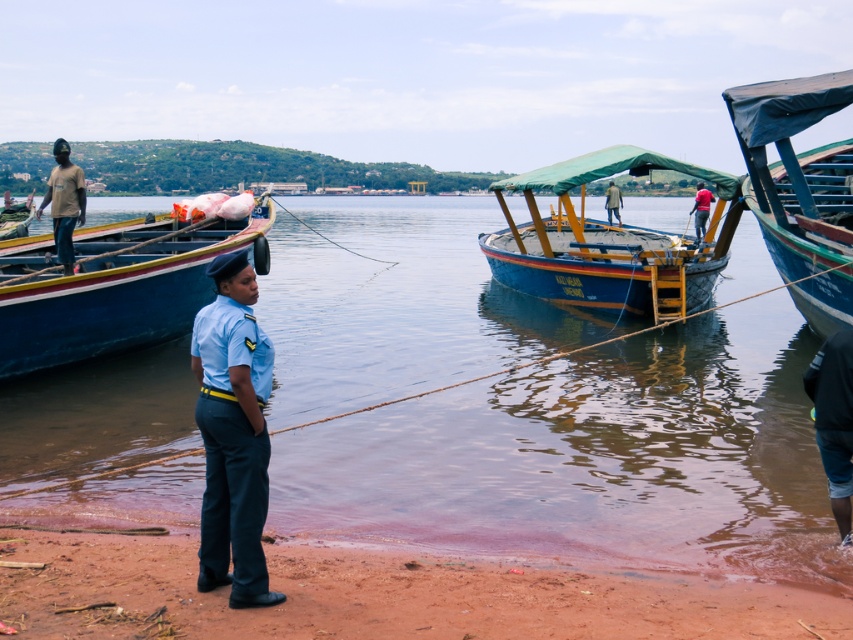
You are a photographer trying to capture both the matte brown shirt at left and the khaki fabric uniform at center in a single frame. Based on their positions, which one is more likely to be fully visible without any part being cut off?

The matte brown shirt at left is wider than the khaki fabric uniform at center, so it might be more likely to be fully visible in the frame if positioned appropriately.

From the picture: You are a photographer positioned at the center of the image. You want to take a photo of the matte brown shirt at left. Which direction should you move to get the best shot?

Since the matte brown shirt at left is located at point 0.317 on the x and 0.076 on the y axis, you should move to the left and slightly downward to center the subject in your frame.

You are a photographer planning to take a group photo of the two people in the scene. The matte brown shirt at left and the khaki fabric uniform at center are both in the frame. To ensure both are fully visible, should you adjust the camera angle to focus more on the foreground or background?

The matte brown shirt at left is in front of the khaki fabric uniform at center, so adjusting the camera angle to focus on the foreground will ensure both are fully visible.